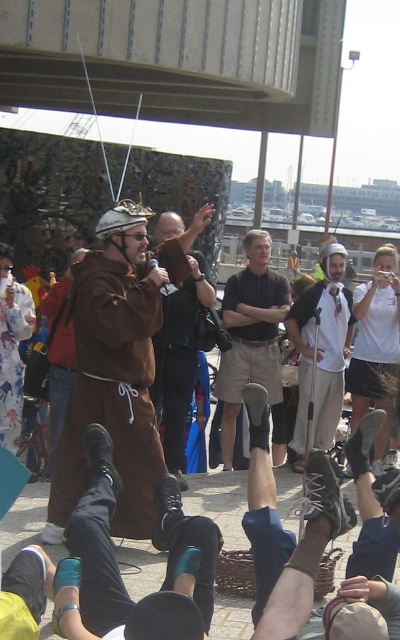
Can you confirm if brown leather robe at center is positioned to the left of brown leather jacket at center?

Correct, you'll find brown leather robe at center to the left of brown leather jacket at center.

Who is lower down, brown leather robe at center or brown leather jacket at center?

brown leather jacket at center is lower down.

The image size is (400, 640). I want to click on brown leather robe at center, so click(x=118, y=365).

Between brown leather robe at center and white cotton shirt at center, which one has more height?

Standing taller between the two is brown leather robe at center.

Is point (140, 454) in front of point (342, 317)?

Yes.

Locate an element on the screen. This screenshot has height=640, width=400. brown leather robe at center is located at coordinates (118, 365).

Between point (225, 301) and point (322, 422), which one is positioned in front?

Point (322, 422) is more forward.

Can you confirm if dark brown shirt at center is taller than white cotton shirt at center?

Correct, dark brown shirt at center is much taller as white cotton shirt at center.

Who is more forward, (260,317) or (342,285)?

Point (260,317) is more forward.

I want to click on dark brown shirt at center, so click(x=250, y=333).